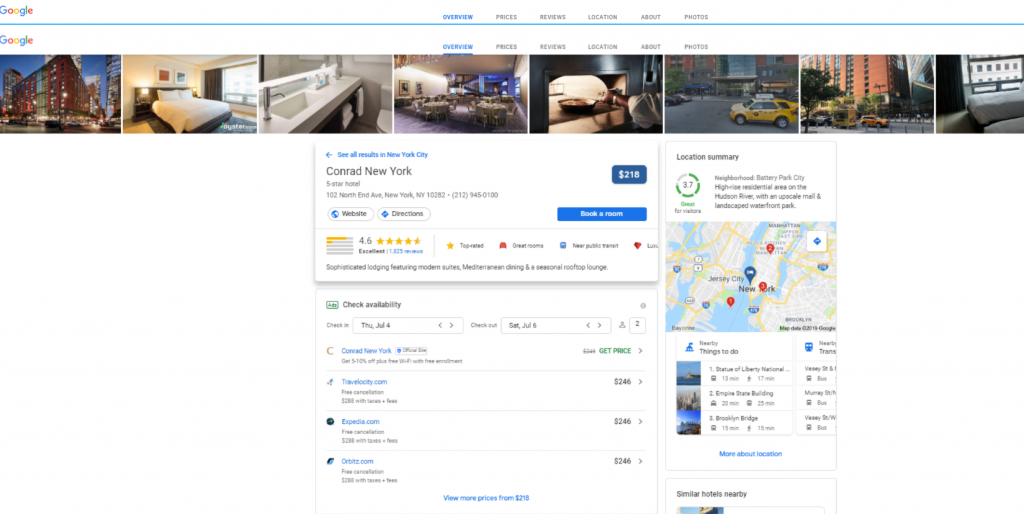
Identify the location of bed. (183, 114).